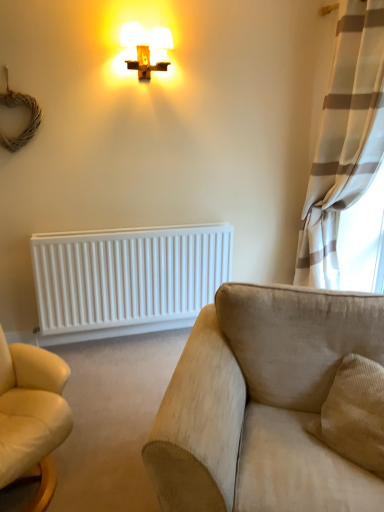
Measure the distance between point [76,309] and camera.

The distance of point [76,309] from camera is 9.41 feet.

This screenshot has width=384, height=512. In order to click on beige fabric couch at lower right in this screenshot , I will do `click(262, 403)`.

Which is correct: white textured curtain at right is inside beige fabric couch at lower right, or outside of it?

white textured curtain at right is not enclosed by beige fabric couch at lower right.

Is point (340, 147) less distant than point (240, 486)?

No, (340, 147) is behind (240, 486).

Consider the image. From a real-world perspective, does white textured curtain at right stand above beige fabric couch at lower right?

Yes, from a real-world perspective, white textured curtain at right is over beige fabric couch at lower right

Is white textured curtain at right not within white matte radiator at lower left?

Yes, white textured curtain at right is outside of white matte radiator at lower left.

The width and height of the screenshot is (384, 512). I want to click on radiator behind the white textured curtain at right, so click(x=127, y=278).

From a real-world perspective, does white textured curtain at right stand above white matte radiator at lower left?

Correct, in the physical world, white textured curtain at right is higher than white matte radiator at lower left.

Does white textured curtain at right have a greater width compared to white matte radiator at lower left?

Correct, the width of white textured curtain at right exceeds that of white matte radiator at lower left.

Does matte gold cross at upper center have a lesser width compared to white matte radiator at lower left?

No.

Could white matte radiator at lower left be considered to be inside matte gold cross at upper center?

Actually, white matte radiator at lower left is outside matte gold cross at upper center.

Consider the image. How much distance is there between matte gold cross at upper center and white matte radiator at lower left?

1.28 meters.

Which is in front, beige fabric couch at lower right or white matte radiator at lower left?

beige fabric couch at lower right is closer to the camera.

Is beige fabric couch at lower right beside white matte radiator at lower left?

beige fabric couch at lower right and white matte radiator at lower left are not in contact.

Is beige fabric couch at lower right positioned with its back to white matte radiator at lower left?

That's not correct — beige fabric couch at lower right is not looking away from white matte radiator at lower left.

At what (x,y) coordinates should I click in order to perform the action: click on lamp on the left side of beige fabric couch at lower right. Please return your answer as a coordinate pair (x, y). This screenshot has height=512, width=384. Looking at the image, I should click on (146, 48).

Is beige fabric couch at lower right oriented away from matte gold cross at upper center?

beige fabric couch at lower right does not have its back to matte gold cross at upper center.

In the scene shown: Which object is wider, beige fabric couch at lower right or matte gold cross at upper center?

With larger width is beige fabric couch at lower right.

Is beige fabric couch at lower right smaller than matte gold cross at upper center?

Actually, beige fabric couch at lower right might be larger than matte gold cross at upper center.

Is matte gold cross at upper center looking in the opposite direction of beige fabric couch at lower right?

No, beige fabric couch at lower right is not at the back of matte gold cross at upper center.

Between matte gold cross at upper center and beige fabric couch at lower right, which one has less height?

matte gold cross at upper center.

Considering the relative sizes of matte gold cross at upper center and beige fabric couch at lower right in the image provided, is matte gold cross at upper center wider than beige fabric couch at lower right?

In fact, matte gold cross at upper center might be narrower than beige fabric couch at lower right.

Is matte gold cross at upper center outside of beige fabric couch at lower right?

That's correct, matte gold cross at upper center is outside of beige fabric couch at lower right.

Is white matte radiator at lower left not inside matte gold cross at upper center?

Yes, white matte radiator at lower left is located beyond the bounds of matte gold cross at upper center.

In the scene shown: Is white matte radiator at lower left facing away from matte gold cross at upper center?

white matte radiator at lower left does not have its back to matte gold cross at upper center.

Is white matte radiator at lower left touching matte gold cross at upper center?

No, white matte radiator at lower left is not with matte gold cross at upper center.

Based on the photo, how far apart are white matte radiator at lower left and matte gold cross at upper center?

white matte radiator at lower left and matte gold cross at upper center are 1.28 meters apart.

You are a GUI agent. You are given a task and a screenshot of the screen. Output one action in this format:
    pyautogui.click(x=<x>, y=<y>)
    Task: Click on the studio couch that appears in front of the white textured curtain at right
    Image resolution: width=384 pixels, height=512 pixels.
    Given the screenshot: What is the action you would take?
    pyautogui.click(x=262, y=403)

Locate an element on the screen. This screenshot has width=384, height=512. radiator that is behind the white textured curtain at right is located at coordinates (127, 278).

From the picture: Based on their spatial positions, is matte gold cross at upper center or white textured curtain at right closer to beige fabric couch at lower right?

white textured curtain at right is closer to beige fabric couch at lower right.

Based on their spatial positions, is white matte radiator at lower left or white textured curtain at right further from matte gold cross at upper center?

The object further to matte gold cross at upper center is white matte radiator at lower left.

Looking at the image, which one is located further to white matte radiator at lower left, white textured curtain at right or matte gold cross at upper center?

Among the two, matte gold cross at upper center is located further to white matte radiator at lower left.

Based on their spatial positions, is beige fabric couch at lower right or matte gold cross at upper center closer to white matte radiator at lower left?

matte gold cross at upper center is positioned closer to the anchor white matte radiator at lower left.

Consider the image. Which object lies nearer to the anchor point matte gold cross at upper center, white matte radiator at lower left or beige fabric couch at lower right?

white matte radiator at lower left is positioned closer to the anchor matte gold cross at upper center.

Considering their positions, is beige fabric couch at lower right positioned further to matte gold cross at upper center than white textured curtain at right?

beige fabric couch at lower right.

Looking at the image, which one is located further to beige fabric couch at lower right, white matte radiator at lower left or white textured curtain at right?

white textured curtain at right lies further to beige fabric couch at lower right than the other object.

Considering their positions, is matte gold cross at upper center positioned closer to white matte radiator at lower left than beige fabric couch at lower right?

Among the two, matte gold cross at upper center is located nearer to white matte radiator at lower left.

You are a GUI agent. You are given a task and a screenshot of the screen. Output one action in this format:
    pyautogui.click(x=<x>, y=<y>)
    Task: Click on the curtain between beige fabric couch at lower right and white matte radiator at lower left along the z-axis
    The height and width of the screenshot is (512, 384).
    Given the screenshot: What is the action you would take?
    pyautogui.click(x=344, y=140)

Where is `curtain between matte gold cross at upper center and beige fabric couch at lower right in the up-down direction`? The width and height of the screenshot is (384, 512). curtain between matte gold cross at upper center and beige fabric couch at lower right in the up-down direction is located at coordinates (344, 140).

You are a GUI agent. You are given a task and a screenshot of the screen. Output one action in this format:
    pyautogui.click(x=<x>, y=<y>)
    Task: Click on the lamp situated between white matte radiator at lower left and white textured curtain at right from left to right
    
    Given the screenshot: What is the action you would take?
    pyautogui.click(x=146, y=48)

This screenshot has width=384, height=512. Find the location of `radiator between matte gold cross at upper center and beige fabric couch at lower right in the vertical direction`. radiator between matte gold cross at upper center and beige fabric couch at lower right in the vertical direction is located at coordinates (127, 278).